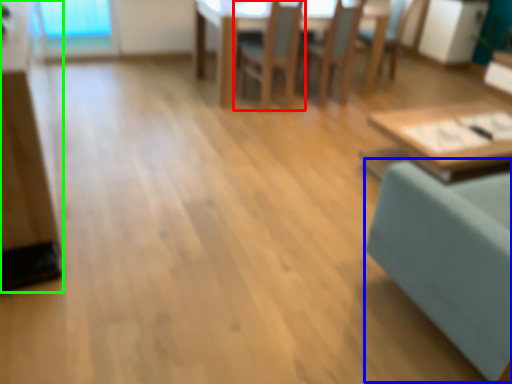
Question: Which is farther away from chair (highlighted by a red box)? swivel chair (highlighted by a blue box) or dresser (highlighted by a green box)?

Choices:
 (A) swivel chair
 (B) dresser

Answer: (A)